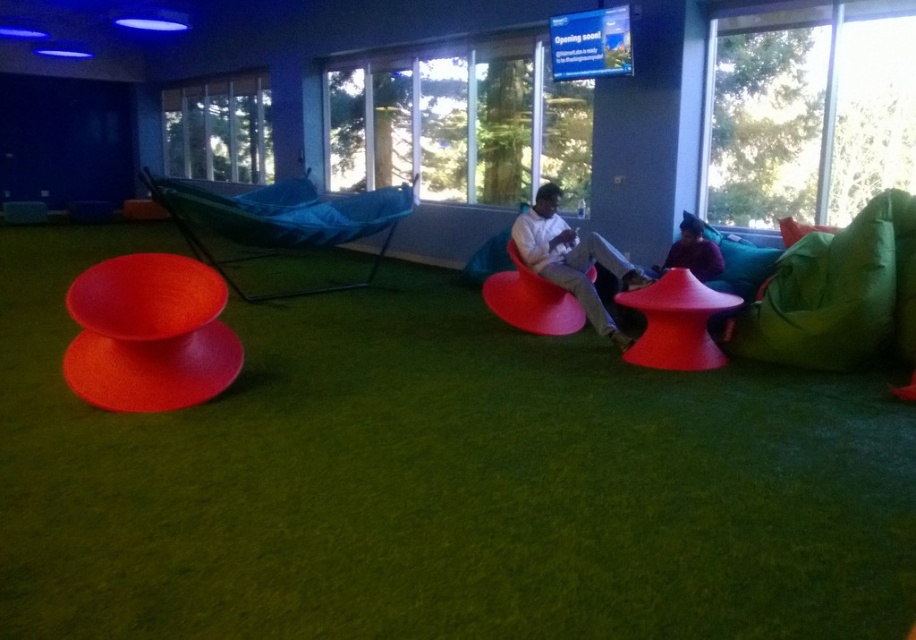
You are a delivery person carrying a package that requires a 10 feet wide space to place. You see the matte red stool at lower left and the blue fabric hammock at center. Is there enough space between them to place your package?

The distance between the matte red stool at lower left and the blue fabric hammock at center is 7.56 feet, which is less than the required 10 feet. Therefore, there isn not enough space to place the package between them.

You are standing in the room and want to sit on the closest seating option between the green fabric bean bag at right and the blue fabric hammock at center. Which one should you choose?

The green fabric bean bag at right is closer to the viewer, so you should choose it to sit on the closest seating option.